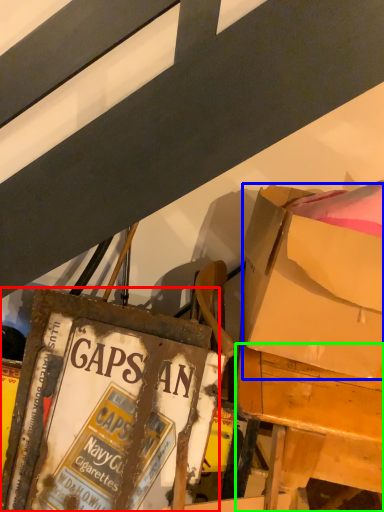
Question: Based on their relative distances, which object is farther from paperback book (highlighted by a red box)? Choose from box (highlighted by a blue box) and desk (highlighted by a green box).

Choices:
 (A) box
 (B) desk

Answer: (A)